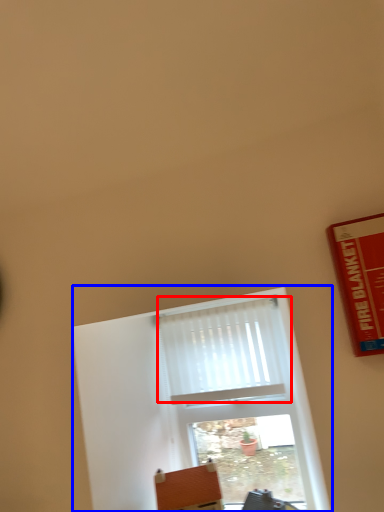
Question: Among these objects, which one is farthest to the camera, curtain (highlighted by a red box) or window (highlighted by a blue box)?

Choices:
 (A) curtain
 (B) window

Answer: (A)